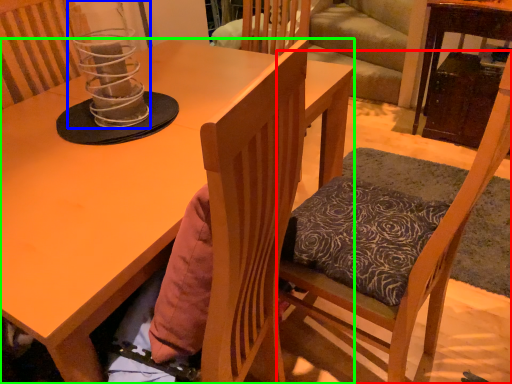
Question: Based on their relative distances, which object is farther from chair (highlighted by a red box)? Choose from candle holder (highlighted by a blue box) and desk (highlighted by a green box).

Choices:
 (A) candle holder
 (B) desk

Answer: (A)